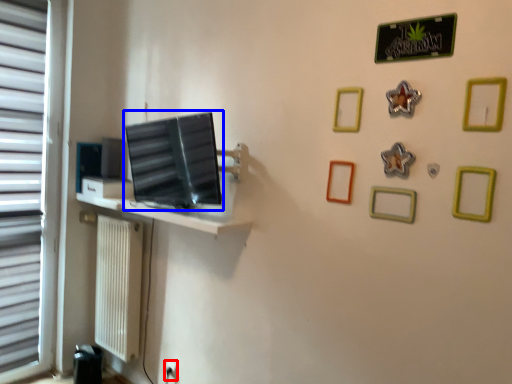
Question: Among these objects, which one is nearest to the camera, electric outlet (highlighted by a red box) or computer monitor (highlighted by a blue box)?

Choices:
 (A) electric outlet
 (B) computer monitor

Answer: (B)